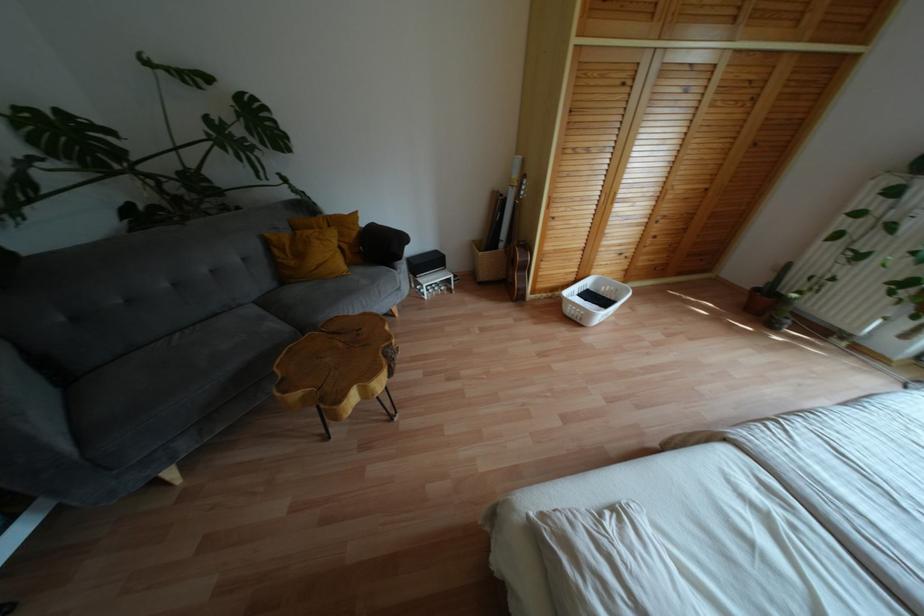
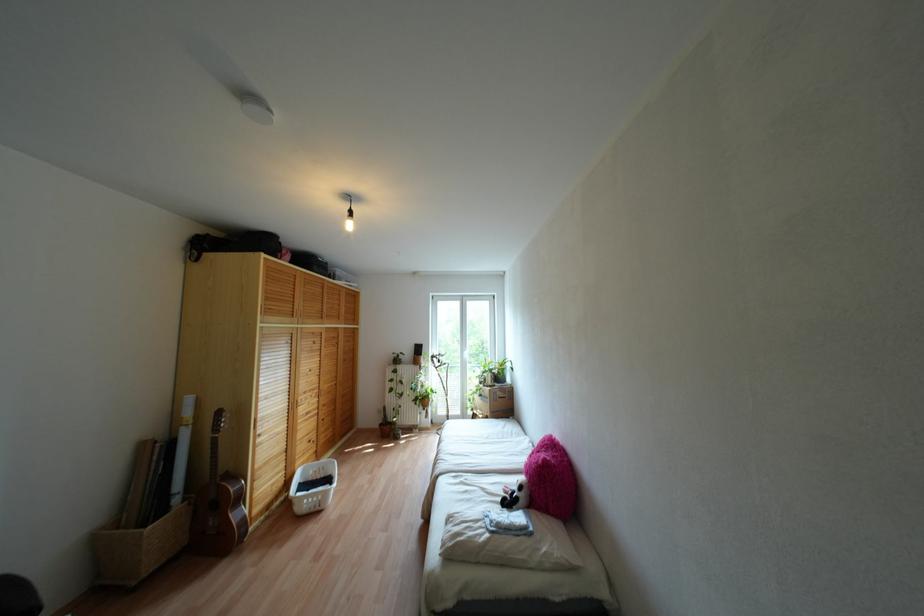
Locate, in the second image, the point that corresponds to pixel 678 187 in the first image.

(324, 387)